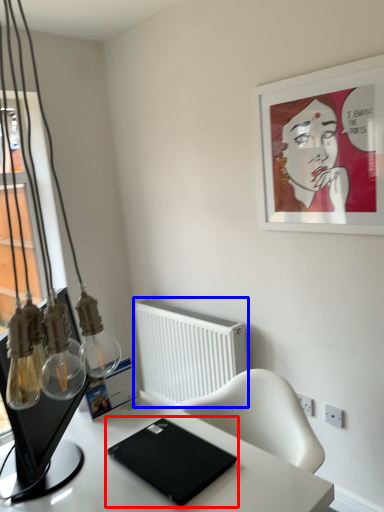
Question: Which object is closer to the camera taking this photo, laptop (highlighted by a red box) or radiator (highlighted by a blue box)?

Choices:
 (A) laptop
 (B) radiator

Answer: (A)